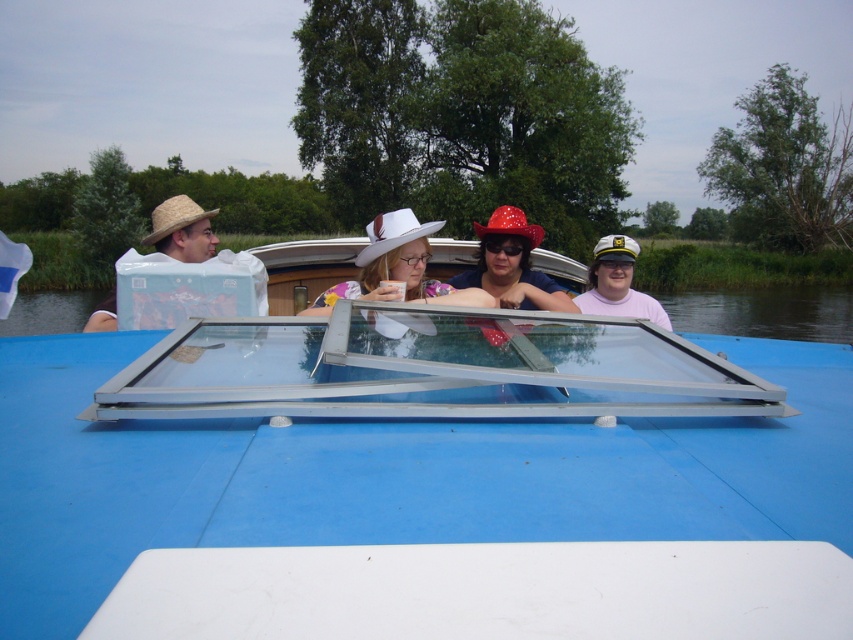
Does transparent glass boat at center have a greater height compared to pink matte cap at center?

No.

Is point (361, 525) behind point (593, 276)?

No, it is in front of (593, 276).

Identify the location of transparent glass boat at center. The height and width of the screenshot is (640, 853). (422, 481).

Who is more forward, (254, 436) or (212, 236)?

Point (254, 436) is in front.

Between transparent glass boat at center and matte straw hat at left, which one appears on the left side from the viewer's perspective?

matte straw hat at left

Which is behind, point (846, 380) or point (192, 253)?

The point (192, 253) is more distant.

Locate an element on the screen. The image size is (853, 640). transparent glass boat at center is located at coordinates (422, 481).

Who is positioned more to the right, pink matte cap at center or matte straw hat at left?

pink matte cap at center

Is point (635, 301) positioned behind point (190, 218)?

Yes, point (635, 301) is behind point (190, 218).

Locate an element on the screen. This screenshot has width=853, height=640. pink matte cap at center is located at coordinates (618, 284).